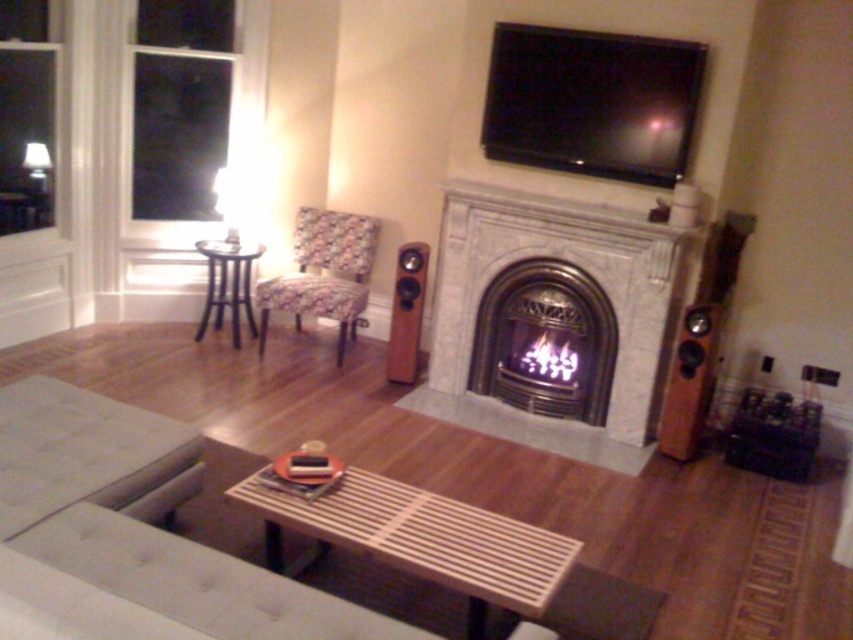
Does white fabric ottoman at lower left have a lesser width compared to floral fabric chair at center?

In fact, white fabric ottoman at lower left might be wider than floral fabric chair at center.

Is white fabric ottoman at lower left positioned behind floral fabric chair at center?

No, white fabric ottoman at lower left is closer to the viewer.

Does point (112, 456) come behind point (315, 228)?

No, it is in front of (315, 228).

Find the location of a particular element. This screenshot has width=853, height=640. white fabric ottoman at lower left is located at coordinates (80, 451).

Between white marble fireplace at center and floral fabric chair at center, which one appears on the right side from the viewer's perspective?

From the viewer's perspective, white marble fireplace at center appears more on the right side.

Is white marble fireplace at center shorter than floral fabric chair at center?

Incorrect, white marble fireplace at center's height does not fall short of floral fabric chair at center's.

At what (x,y) coordinates should I click in order to perform the action: click on white marble fireplace at center. Please return your answer as a coordinate pair (x, y). The image size is (853, 640). Looking at the image, I should click on (561, 259).

Identify the location of white marble fireplace at center. (561, 259).

Who is higher up, polished brass fireplace at center or floral fabric chair at center?

Positioned higher is floral fabric chair at center.

The image size is (853, 640). What are the coordinates of `polished brass fireplace at center` in the screenshot? It's located at (544, 340).

Locate an element on the screen. This screenshot has height=640, width=853. polished brass fireplace at center is located at coordinates (544, 340).